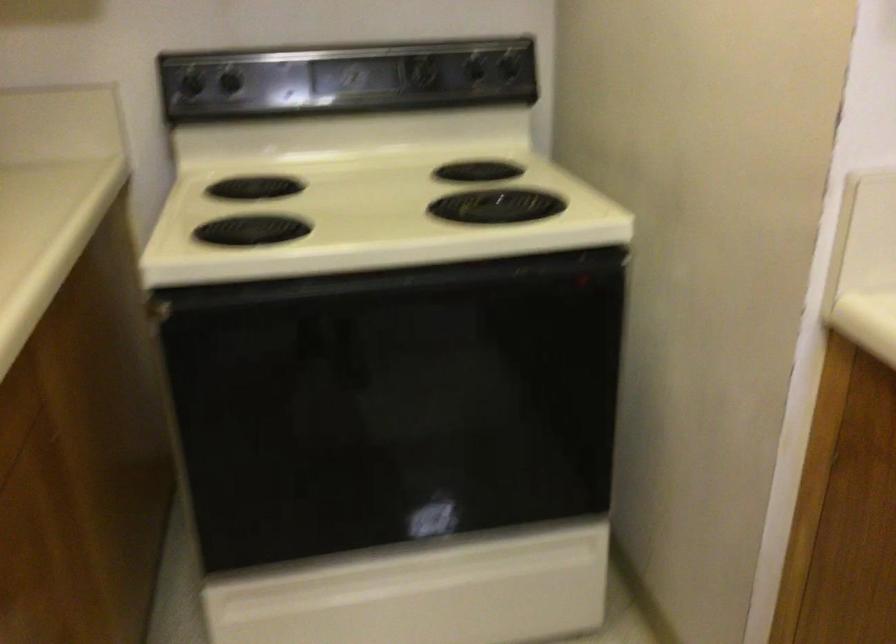
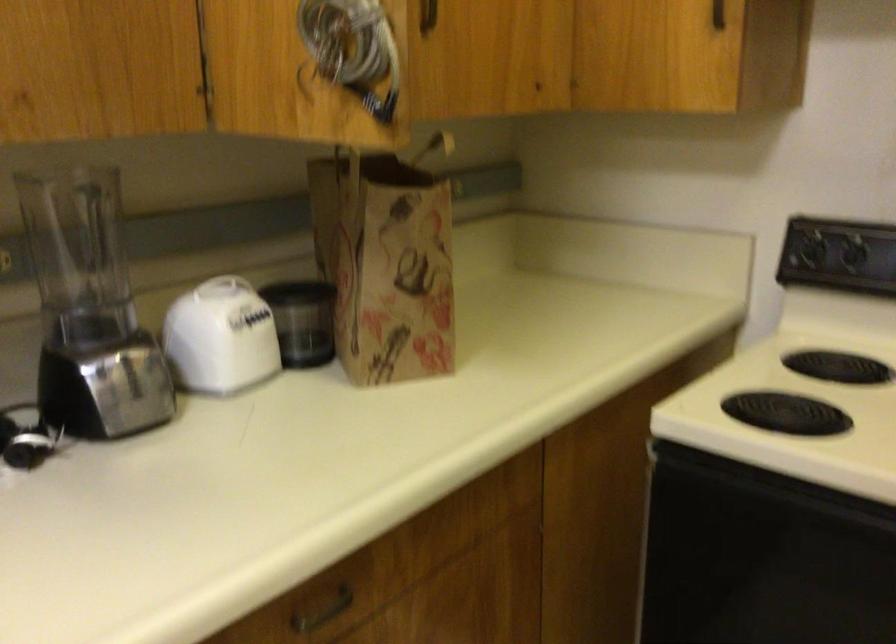
Question: The images are taken continuously from a first-person perspective. In which direction is your viewpoint rotating?

Choices:
 (A) Left
 (B) Right
 (C) Up
 (D) Down

Answer: (A)